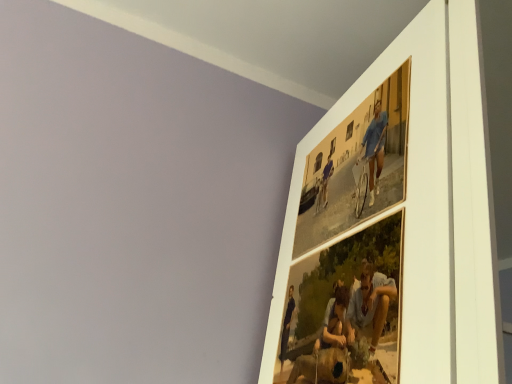
Question: Is matte wooden photo frame at upper right, which is the first picture frame from bottom to top, taller than matte paper photo frame at upper right, which is the 1th picture frame from top to bottom?

Choices:
 (A) no
 (B) yes

Answer: (A)

Question: Does matte wooden photo frame at upper right, which is the first picture frame from bottom to top, appear on the left side of matte paper photo frame at upper right, which is the 1th picture frame from top to bottom?

Choices:
 (A) no
 (B) yes

Answer: (B)

Question: Could you tell me if matte wooden photo frame at upper right, which is the first picture frame from bottom to top, is facing matte paper photo frame at upper right, which is the 1th picture frame from top to bottom?

Choices:
 (A) no
 (B) yes

Answer: (A)

Question: Considering the relative sizes of matte wooden photo frame at upper right, acting as the 2th picture frame starting from the top, and matte paper photo frame at upper right, which is the 1th picture frame from top to bottom, in the image provided, is matte wooden photo frame at upper right, acting as the 2th picture frame starting from the top, thinner than matte paper photo frame at upper right, which is the 1th picture frame from top to bottom,?

Choices:
 (A) yes
 (B) no

Answer: (B)

Question: Is matte wooden photo frame at upper right, acting as the 2th picture frame starting from the top, at the right side of matte paper photo frame at upper right, which ranks as the 2th picture frame in bottom-to-top order?

Choices:
 (A) no
 (B) yes

Answer: (A)

Question: Is matte wooden photo frame at upper right, which is the first picture frame from bottom to top, smaller than matte paper photo frame at upper right, which ranks as the 2th picture frame in bottom-to-top order?

Choices:
 (A) no
 (B) yes

Answer: (A)

Question: Does matte paper photo frame at upper right, which ranks as the 2th picture frame in bottom-to-top order, have a smaller size compared to matte wooden photo frame at upper right, which is the first picture frame from bottom to top?

Choices:
 (A) no
 (B) yes

Answer: (B)

Question: Is matte paper photo frame at upper right, which is the 1th picture frame from top to bottom, turned away from matte wooden photo frame at upper right, acting as the 2th picture frame starting from the top?

Choices:
 (A) no
 (B) yes

Answer: (A)

Question: Can you confirm if matte paper photo frame at upper right, which is the 1th picture frame from top to bottom, is positioned to the left of matte wooden photo frame at upper right, acting as the 2th picture frame starting from the top?

Choices:
 (A) yes
 (B) no

Answer: (B)

Question: Is the depth of matte paper photo frame at upper right, which ranks as the 2th picture frame in bottom-to-top order, greater than that of matte wooden photo frame at upper right, acting as the 2th picture frame starting from the top?

Choices:
 (A) yes
 (B) no

Answer: (A)

Question: From the image's perspective, is matte paper photo frame at upper right, which is the 1th picture frame from top to bottom, above matte wooden photo frame at upper right, which is the first picture frame from bottom to top?

Choices:
 (A) no
 (B) yes

Answer: (B)

Question: From the image's perspective, is matte paper photo frame at upper right, which is the 1th picture frame from top to bottom, under matte wooden photo frame at upper right, acting as the 2th picture frame starting from the top?

Choices:
 (A) yes
 (B) no

Answer: (B)

Question: Relative to matte wooden photo frame at upper right, which is the first picture frame from bottom to top, is matte paper photo frame at upper right, which is the 1th picture frame from top to bottom, in front or behind?

Choices:
 (A) behind
 (B) front

Answer: (A)